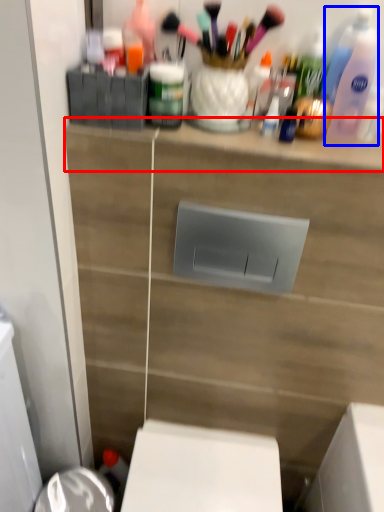
Question: Which object appears farthest to the camera in this image, ledge (highlighted by a red box) or cleaning product (highlighted by a blue box)?

Choices:
 (A) ledge
 (B) cleaning product

Answer: (A)